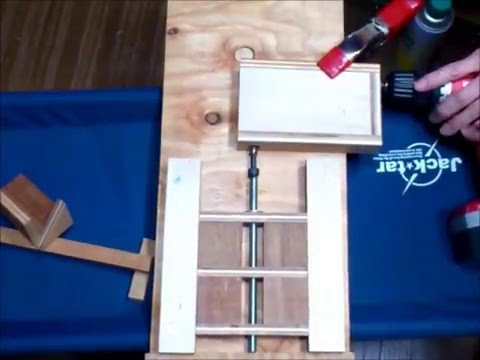
At what (x,y) coordinates should I click in order to perform the action: click on blue sheet. Please return your answer as a coordinate pair (x, y). This screenshot has width=480, height=360. Looking at the image, I should click on (98, 169).